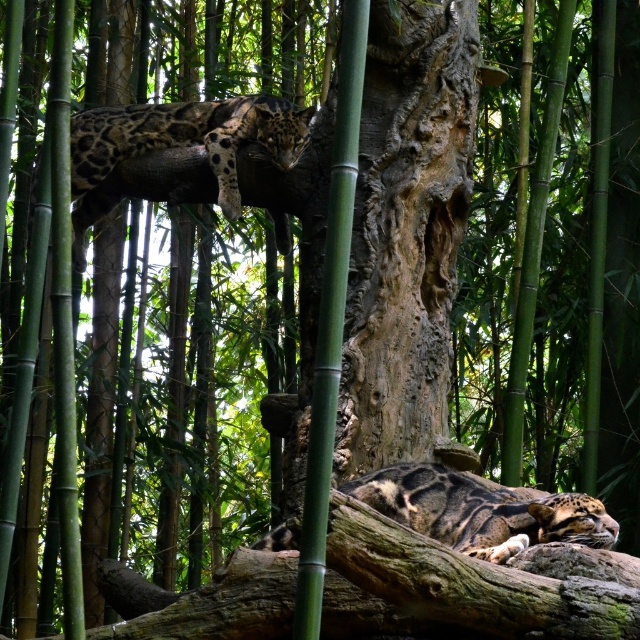
Based on the photo, you are a wildlife photographer aiming to capture a closeup shot of the clouded leopard at upper left. Your camera has a maximum zoom range of 50 feet. Can you get a clear closeup without moving closer?

The clouded leopard at upper left and camera are 81.42 feet apart from each other, which exceeds the camera maximum zoom range of 50 feet. Therefore, you cannot get a clear closeup without moving closer.

In the forest scene with dense bamboo stalks, there is a rough bark tree trunk at center and a clouded leopard at lower center. From the perspective of an observer looking at the image, which object is positioned to the right side?

The clouded leopard at lower center is positioned to the right of the rough bark tree trunk at center.

Based on the photo, you are a wildlife photographer aiming to capture a clear shot of the clouded leopard at upper left. Since the rough bark tree trunk at center is blocking part of the leopard, can you adjust your position to avoid the trunk? Please explain based on their positions.

The rough bark tree trunk at center is located below the clouded leopard at upper left. By positioning yourself lower and angling the camera upward, you can avoid the trunk and capture the leopard without obstruction.